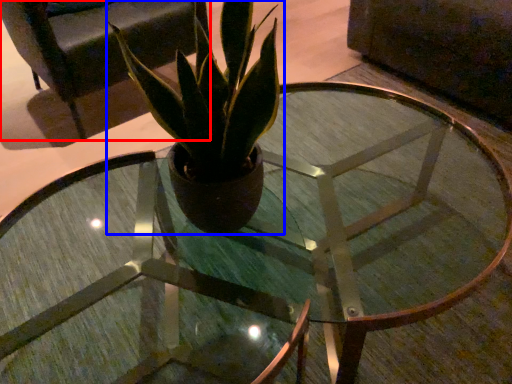
Question: Which object is further to the camera taking this photo, armchair (highlighted by a red box) or houseplant (highlighted by a blue box)?

Choices:
 (A) armchair
 (B) houseplant

Answer: (A)